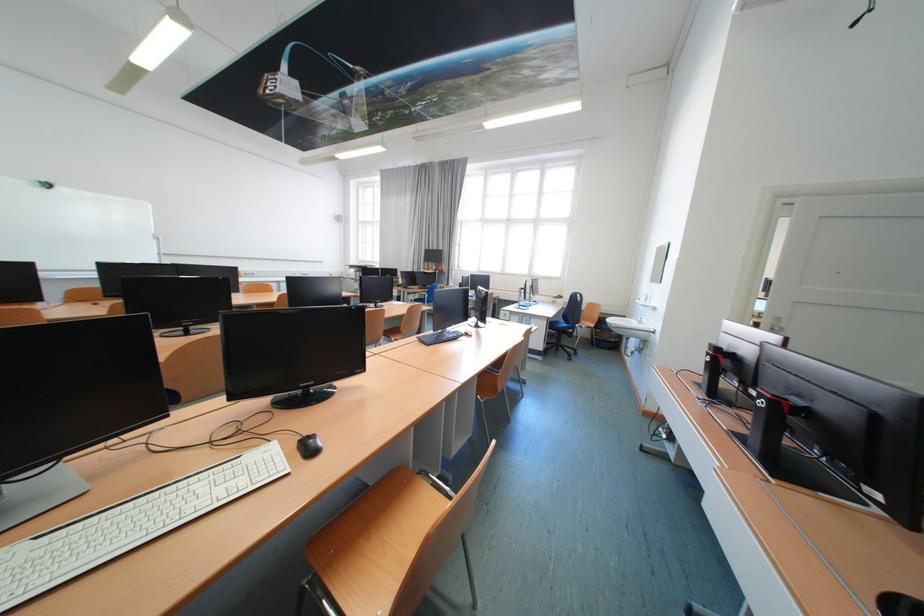
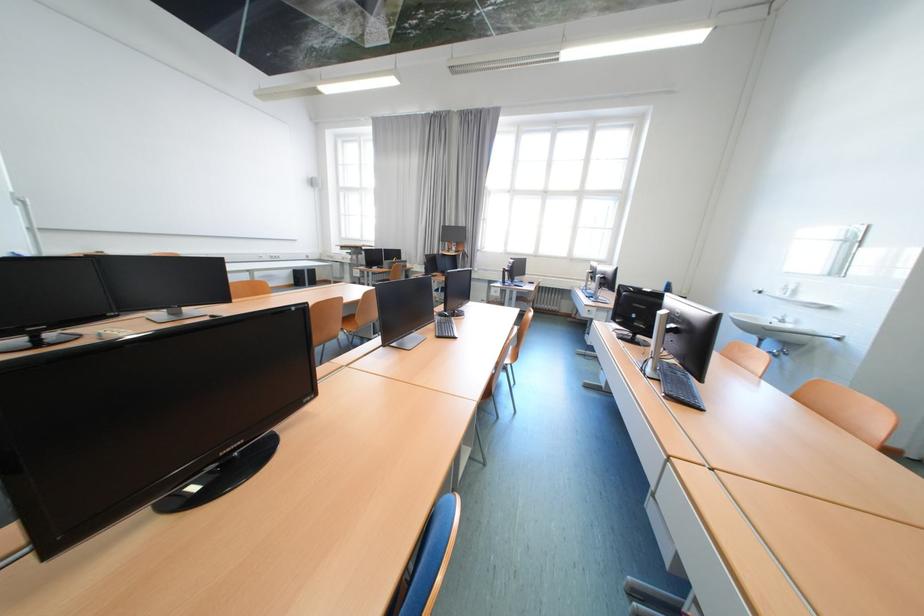
Which direction would the cameraman need to move to produce the second image?

The cameraman moved toward left, forward.